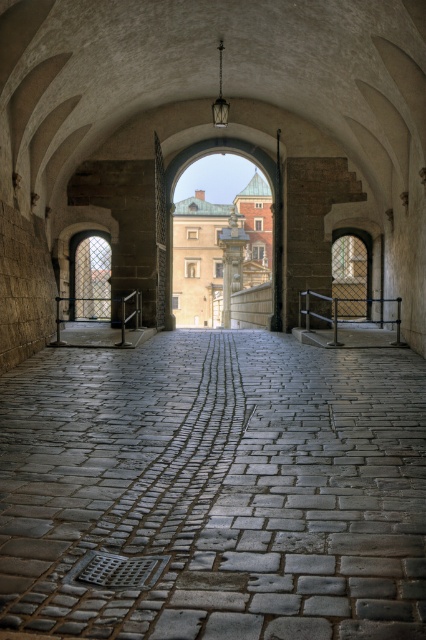
Question: Can you confirm if gray cobblestone path at center is wider than smooth stone pillar at center?

Choices:
 (A) no
 (B) yes

Answer: (B)

Question: Considering the relative positions of gray cobblestone path at center and smooth stone pillar at center in the image provided, where is gray cobblestone path at center located with respect to smooth stone pillar at center?

Choices:
 (A) below
 (B) above

Answer: (A)

Question: Is the position of gray cobblestone path at center more distant than that of smooth stone pillar at center?

Choices:
 (A) no
 (B) yes

Answer: (A)

Question: Which point is farther from the camera taking this photo?

Choices:
 (A) (161, 483)
 (B) (224, 284)

Answer: (B)